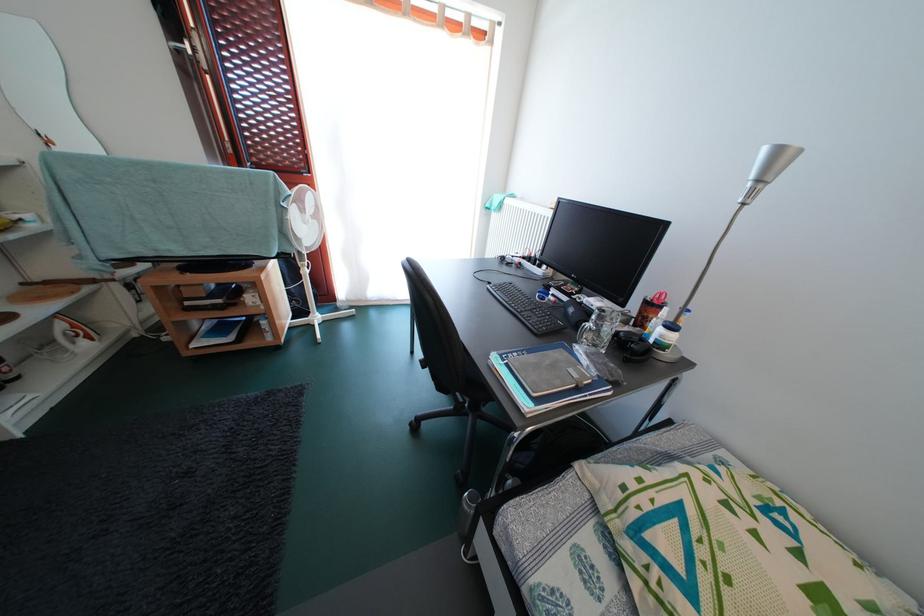
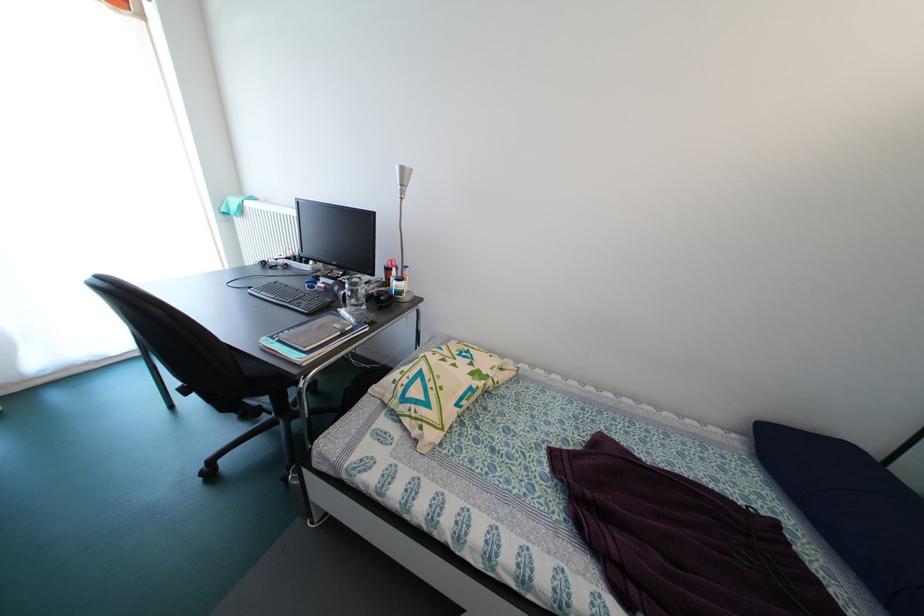
Locate, in the second image, the point that corresponds to (x=602, y=351) in the first image.

(362, 310)